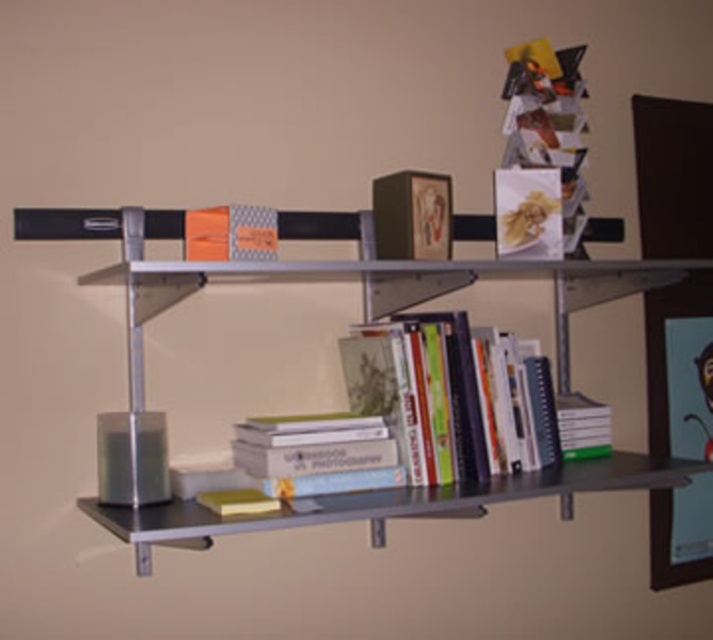
You are organizing books on a shelf. You have a hardcover books at center and a yellow matte book at lower center. Which book should you place on the lower shelf if you want to arrange them from largest to smallest?

You should place the yellow matte book at lower center on the lower shelf because the hardcover books at center is larger in size than yellow matte book at lower center, so arranging from largest to smallest would require placing the smaller one lower.